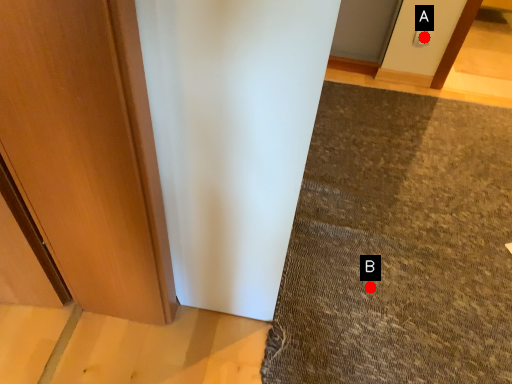
Question: Two points are circled on the image, labeled by A and B beside each circle. Which point appears closest to the camera in this image?

Choices:
 (A) A is closer
 (B) B is closer

Answer: (B)